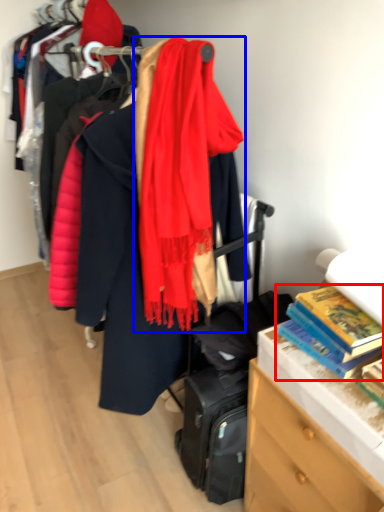
Question: Which object is closer to the camera taking this photo, book (highlighted by a red box) or scarf (highlighted by a blue box)?

Choices:
 (A) book
 (B) scarf

Answer: (B)